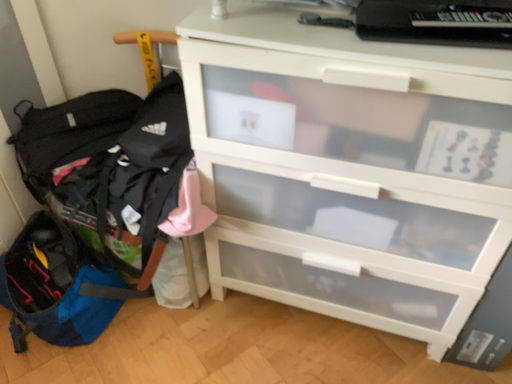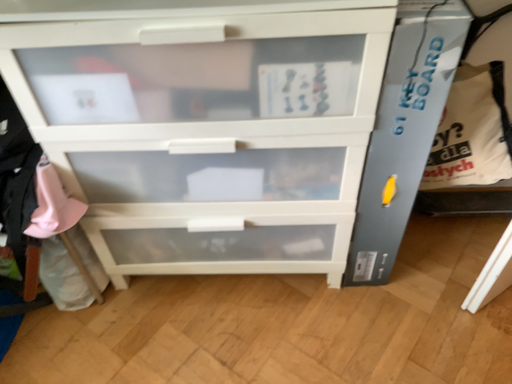
Question: Which way did the camera rotate in the video?

Choices:
 (A) rotated left
 (B) rotated right

Answer: (B)